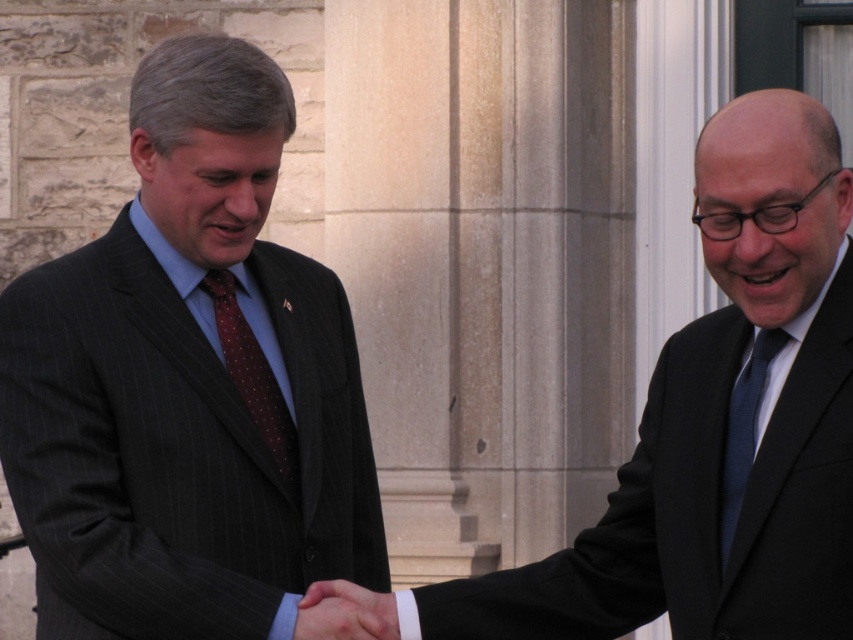
Question: Can you confirm if dark pinstripe suit at center is positioned above dark blue silk tie at right?

Choices:
 (A) yes
 (B) no

Answer: (A)

Question: Which point is closer to the camera?

Choices:
 (A) dark pinstripe suit at left
 (B) smooth skin handshake at center

Answer: (A)

Question: Which of the following is the farthest from the observer?

Choices:
 (A) (155, 77)
 (B) (728, 403)
 (C) (834, 561)

Answer: (A)

Question: From the image, what is the correct spatial relationship of dark pinstripe suit at left in relation to smooth skin handshake at center?

Choices:
 (A) above
 (B) below

Answer: (A)

Question: Which point is closer to the camera?

Choices:
 (A) (216, 289)
 (B) (743, 410)

Answer: (B)

Question: Can you confirm if dark pinstripe suit at left is positioned to the right of dark pinstripe suit at center?

Choices:
 (A) yes
 (B) no

Answer: (B)